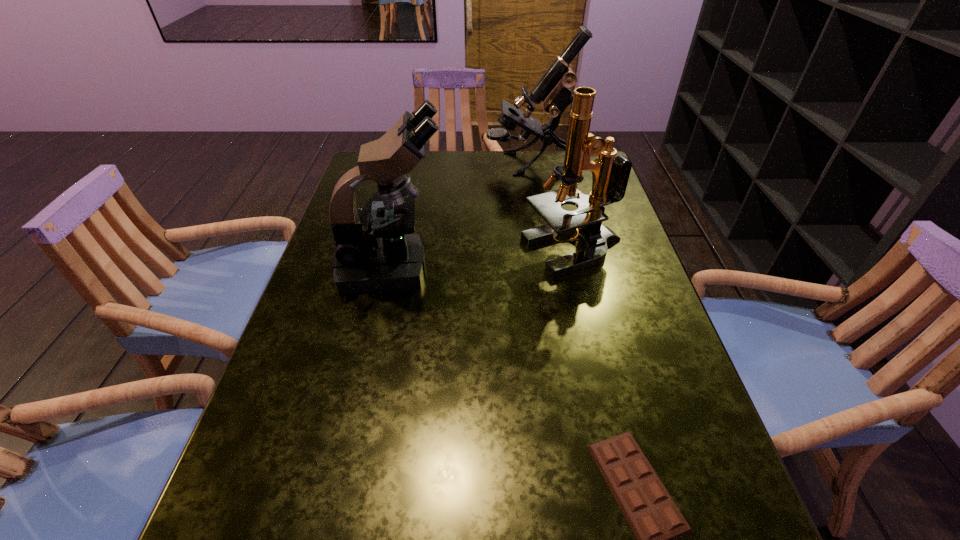
Locate an element on the screen. vacant point at the left edge is located at coordinates (311, 456).

Where is `vacant region at the right edge`? The width and height of the screenshot is (960, 540). vacant region at the right edge is located at coordinates (674, 345).

The width and height of the screenshot is (960, 540). What are the coordinates of `blank region between the farthest microscope and the leftmost microscope` in the screenshot? It's located at (461, 215).

Where is `vacant area between the leftmost microscope and the farthest object`? vacant area between the leftmost microscope and the farthest object is located at coordinates (461, 215).

Choose which object is the second nearest neighbor to the shortest object. Please provide its 2D coordinates. Your answer should be formatted as a tuple, i.e. [(x, y)], where the tuple contains the x and y coordinates of a point satisfying the conditions above.

[(375, 250)]

In order to click on object that stands as the closest to the nearest object in this screenshot , I will do `click(610, 174)`.

Select which microscope appears as the second closest to the leftmost microscope. Please provide its 2D coordinates. Your answer should be formatted as a tuple, i.e. [(x, y)], where the tuple contains the x and y coordinates of a point satisfying the conditions above.

[(553, 90)]

You are a GUI agent. You are given a task and a screenshot of the screen. Output one action in this format:
    pyautogui.click(x=<x>, y=<y>)
    Task: Click on the third closest microscope to the chocolate bar
    This screenshot has height=540, width=960.
    Given the screenshot: What is the action you would take?
    pyautogui.click(x=553, y=90)

The width and height of the screenshot is (960, 540). What are the coordinates of `vacant space that satisfies the following two spatial constraints: 1. through the eyepiece of the farthest microscope; 2. on the front side of the leftmost microscope` in the screenshot? It's located at (547, 268).